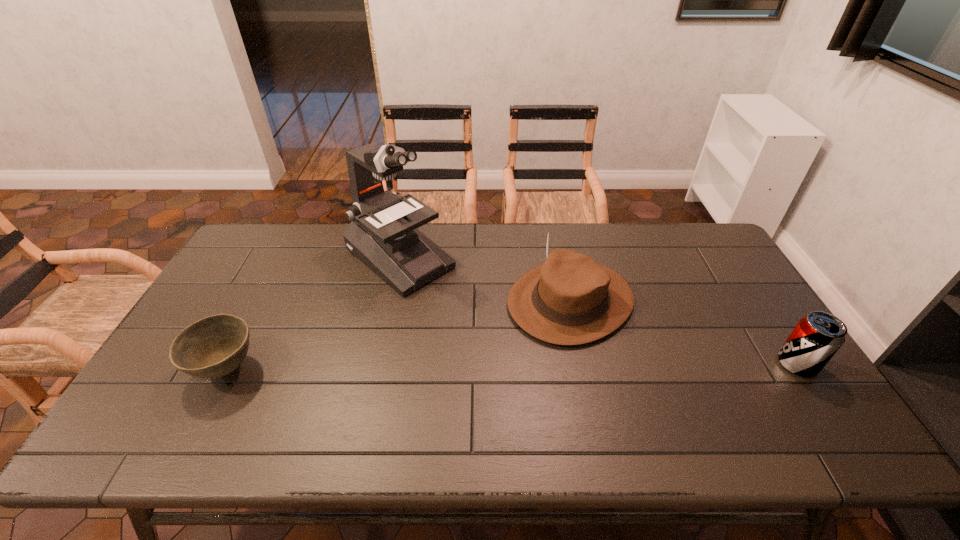
The width and height of the screenshot is (960, 540). Identify the location of object that is at the right edge. (816, 338).

In order to click on object at the near left corner in this screenshot , I will do `click(214, 346)`.

The image size is (960, 540). Find the location of `free space at the far edge of the desktop`. free space at the far edge of the desktop is located at coordinates (470, 249).

The height and width of the screenshot is (540, 960). In the image, there is a desktop. In order to click on vacant space at the near edge in this screenshot , I will do `click(697, 390)`.

Identify the location of blank space at the left edge of the desktop. The width and height of the screenshot is (960, 540). (243, 282).

You are a GUI agent. You are given a task and a screenshot of the screen. Output one action in this format:
    pyautogui.click(x=<x>, y=<y>)
    Task: Click on the vacant region at the near right corner of the desktop
    The image size is (960, 540).
    Given the screenshot: What is the action you would take?
    pyautogui.click(x=770, y=402)

Locate an element on the screen. Image resolution: width=960 pixels, height=540 pixels. free space between the third shortest object and the third tallest object is located at coordinates (684, 332).

In order to click on free space that is in between the shortest object and the rightmost object in this screenshot , I will do `click(512, 366)`.

Image resolution: width=960 pixels, height=540 pixels. Identify the location of vacant area that lies between the leftmost object and the fedora. (398, 335).

Identify the location of vacant area between the tallest object and the second object from right to left. The width and height of the screenshot is (960, 540). (485, 279).